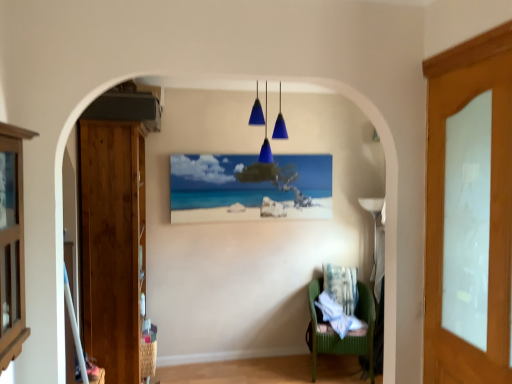
You are a GUI agent. You are given a task and a screenshot of the screen. Output one action in this format:
    pyautogui.click(x=<x>, y=<y>)
    Task: Click on the vacant region above white glass door at right, which ranks as the second door in back-to-front order (from a real-world perspective)
    The image size is (512, 384).
    Given the screenshot: What is the action you would take?
    pyautogui.click(x=475, y=36)